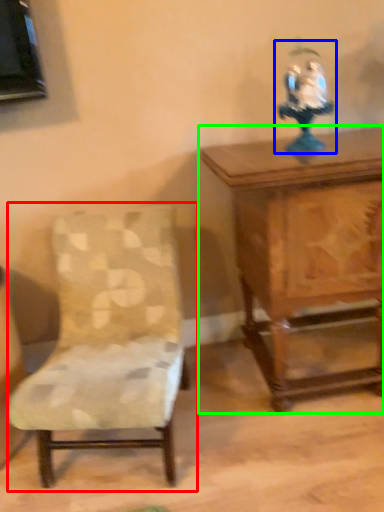
Question: Which object is positioned farthest from chair (highlighted by a red box)? Select from toy (highlighted by a blue box) and table (highlighted by a green box).

Choices:
 (A) toy
 (B) table

Answer: (A)